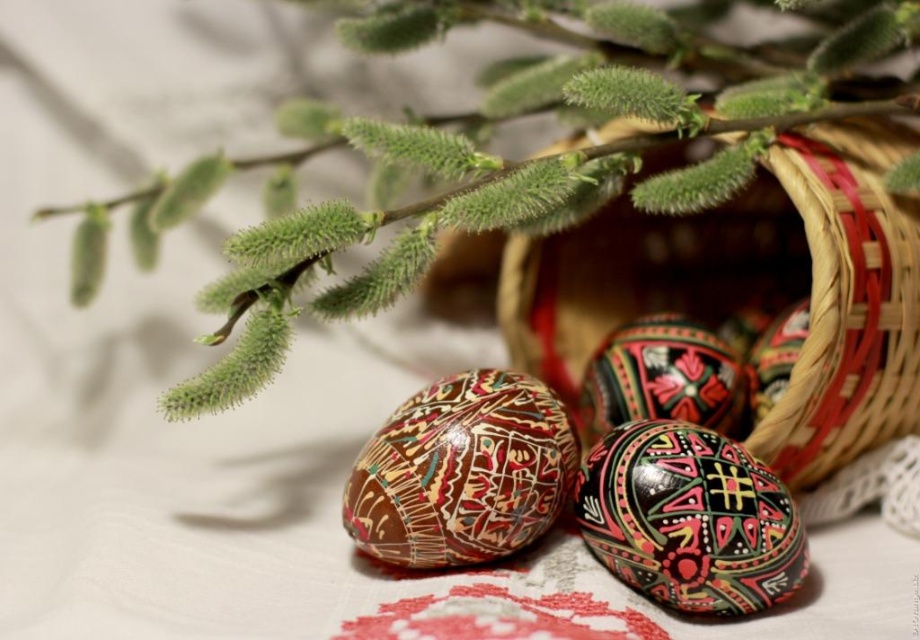
You are an artist setting up a still life and need to arrange the green fuzzy branch at upper center and the brown woven basket at center. Based on the image, which object should you place in front to maintain the original perspective?

The green fuzzy branch at upper center should be placed in front of the brown woven basket at center because it is closer to the viewer in the original image.

You are taking a photo of the festive arrangement and want to focus on the point that is closer to the camera. Which point should you choose between point (786,269) and point (705,540)?

Point (705,540) is closer to the camera than point (786,269), so you should focus on point (705,540).